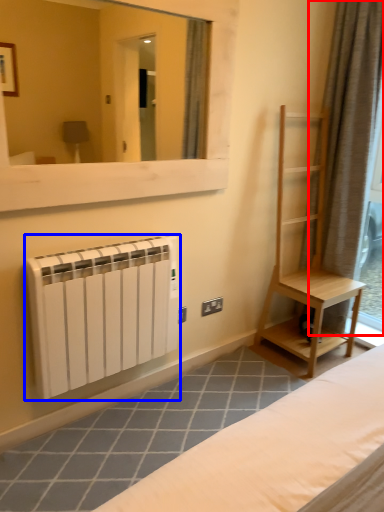
Question: Which point is closer to the camera, curtain (highlighted by a red box) or radiator (highlighted by a blue box)?

Choices:
 (A) curtain
 (B) radiator

Answer: (B)